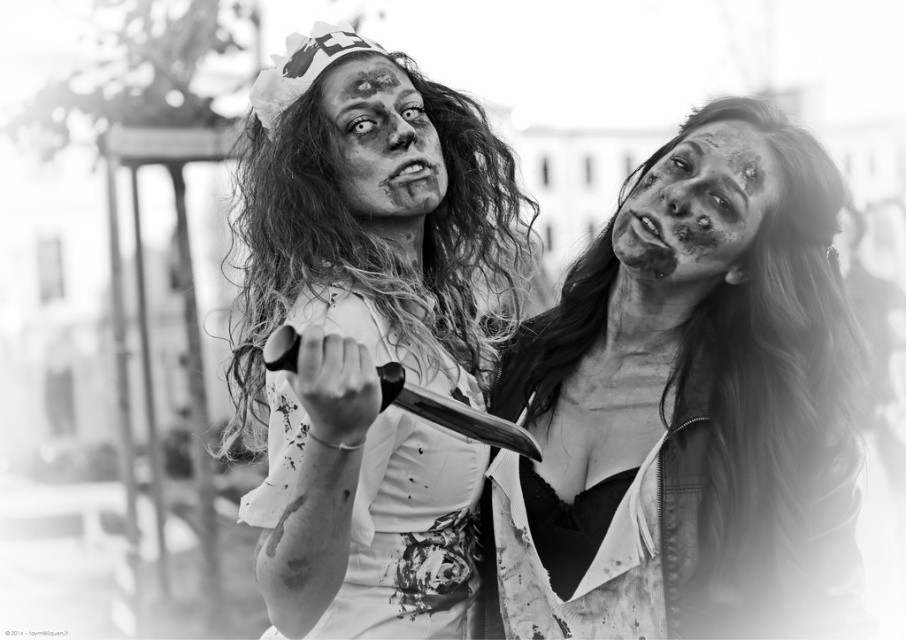
You are a costume designer analyzing this black and white photo. You need to determine which costume element is shorter between the matte white jacket at center and the matte white dress at center. Which one is shorter?

The matte white jacket at center is shorter than the matte white dress at center according to the description.

You are a costume designer analyzing this black and white photo. You need to determine the spatial relationship between the matte white jacket at center and the white textured dress at center. Based on the scene, which one is positioned higher?

The matte white jacket at center is located above the white textured dress at center, so the matte white jacket at center is positioned higher.

You are a costume designer who needs to locate the matte white jacket at center in the image. According to the coordinates provided, where exactly should you look?

The matte white jacket at center is located at point 0.637 on the x axis and 0.760 on the y axis.